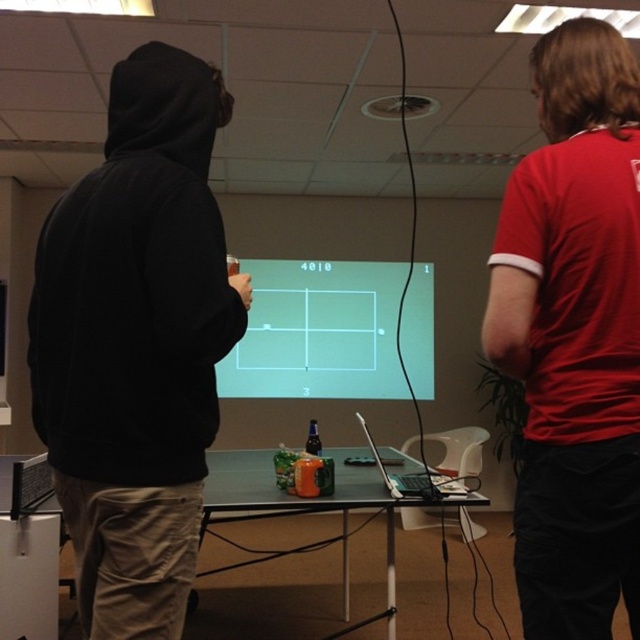
Is green matte projection screen at center shorter than silver metallic laptop at center?

In fact, green matte projection screen at center may be taller than silver metallic laptop at center.

Is point (390, 396) positioned in front of point (451, 490)?

No, (390, 396) is further to viewer.

This screenshot has height=640, width=640. I want to click on green matte projection screen at center, so click(x=317, y=332).

Does point (381, 310) lie behind point (349, 477)?

Yes.

Is green matte projection screen at center thinner than green plastic table at center?

No.

Identify the location of green matte projection screen at center. The height and width of the screenshot is (640, 640). (317, 332).

Is point (529, 224) less distant than point (435, 492)?

Yes, it is.

Can you confirm if red cotton shirt at right is positioned below silver metallic laptop at center?

No.

Where is `red cotton shirt at right`? The width and height of the screenshot is (640, 640). red cotton shirt at right is located at coordinates (573, 336).